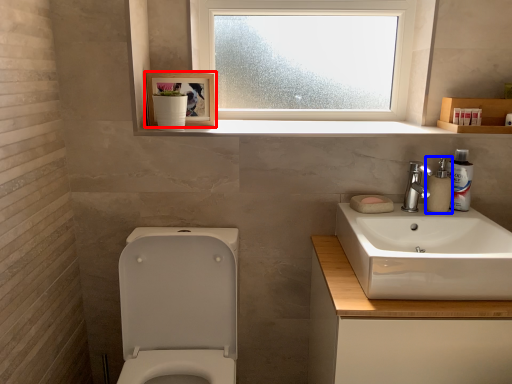
Question: Which of the following is the farthest to the observer, picture frame (highlighted by a red box) or soap dispenser (highlighted by a blue box)?

Choices:
 (A) picture frame
 (B) soap dispenser

Answer: (A)